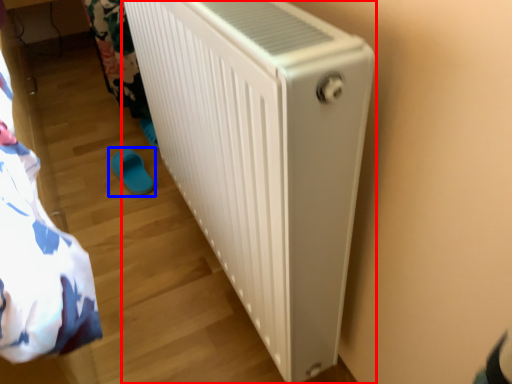
Question: Which object is further to the camera taking this photo, home appliance (highlighted by a red box) or footwear (highlighted by a blue box)?

Choices:
 (A) home appliance
 (B) footwear

Answer: (B)